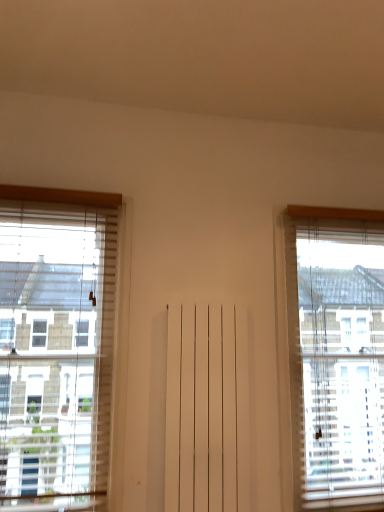
Question: From a real-world perspective, is white wooden window at left, acting as the 1th window starting from the left, beneath translucent wood window at right, which ranks as the 2th window in left-to-right order?

Choices:
 (A) no
 (B) yes

Answer: (A)

Question: Is white wooden window at left, acting as the 1th window starting from the left, outside translucent wood window at right, the 1th window from the right?

Choices:
 (A) yes
 (B) no

Answer: (A)

Question: Is white wooden window at left, acting as the 1th window starting from the left, taller than translucent wood window at right, the 1th window from the right?

Choices:
 (A) no
 (B) yes

Answer: (A)

Question: Does white wooden window at left, positioned as the 2th window in right-to-left order, have a lesser width compared to translucent wood window at right, which ranks as the 2th window in left-to-right order?

Choices:
 (A) no
 (B) yes

Answer: (B)

Question: Is white wooden window at left, acting as the 1th window starting from the left, far away from translucent wood window at right, which ranks as the 2th window in left-to-right order?

Choices:
 (A) yes
 (B) no

Answer: (A)

Question: Is white wooden window at left, positioned as the 2th window in right-to-left order, positioned before translucent wood window at right, the 1th window from the right?

Choices:
 (A) yes
 (B) no

Answer: (A)

Question: Can you confirm if translucent wood window at right, the 1th window from the right, is smaller than white wooden window at left, positioned as the 2th window in right-to-left order?

Choices:
 (A) no
 (B) yes

Answer: (A)

Question: Is translucent wood window at right, which ranks as the 2th window in left-to-right order, outside white wooden window at left, positioned as the 2th window in right-to-left order?

Choices:
 (A) yes
 (B) no

Answer: (A)

Question: From the image's perspective, is translucent wood window at right, which ranks as the 2th window in left-to-right order, under white wooden window at left, positioned as the 2th window in right-to-left order?

Choices:
 (A) yes
 (B) no

Answer: (A)

Question: Is translucent wood window at right, which ranks as the 2th window in left-to-right order, at the right side of white wooden window at left, positioned as the 2th window in right-to-left order?

Choices:
 (A) yes
 (B) no

Answer: (A)

Question: From a real-world perspective, is translucent wood window at right, the 1th window from the right, located beneath white wooden window at left, positioned as the 2th window in right-to-left order?

Choices:
 (A) yes
 (B) no

Answer: (A)

Question: Does translucent wood window at right, the 1th window from the right, have a greater height compared to white wooden window at left, positioned as the 2th window in right-to-left order?

Choices:
 (A) no
 (B) yes

Answer: (B)

Question: Choose the correct answer: Is white wooden window at left, acting as the 1th window starting from the left, inside translucent wood window at right, the 1th window from the right, or outside it?

Choices:
 (A) inside
 (B) outside

Answer: (B)